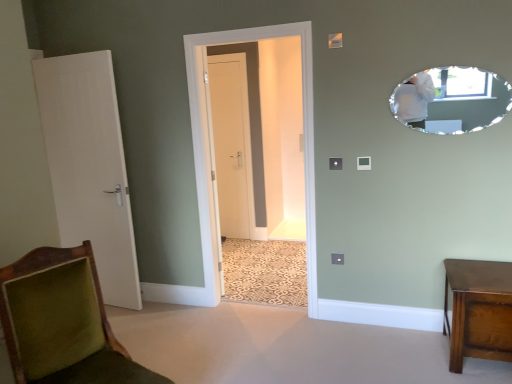
In order to face white matte door at center, the first door when ordered from back to front, should I rotate leftwards or rightwards?

You should look left and rotate roughly 3.662 degrees.

What is the approximate width of white wood door at left, the 2th door in the back-to-front sequence?

The width of white wood door at left, the 2th door in the back-to-front sequence, is 6.55 inches.

Describe the element at coordinates (89, 166) in the screenshot. I see `white wood door at left, which is the first door in front-to-back order` at that location.

You are a GUI agent. You are given a task and a screenshot of the screen. Output one action in this format:
    pyautogui.click(x=<x>, y=<y>)
    Task: Click on the shiny brown wooden side table at lower right
    The height and width of the screenshot is (384, 512).
    Given the screenshot: What is the action you would take?
    pyautogui.click(x=479, y=310)

What do you see at coordinates (62, 322) in the screenshot? I see `velvet green chair at lower left` at bounding box center [62, 322].

Where is `clear glass door at center`? Image resolution: width=512 pixels, height=384 pixels. clear glass door at center is located at coordinates (303, 130).

Locate an element on the screen. oval-shaped mirror at upper right is located at coordinates (452, 100).

Locate an element on the screen. glass door above the velvet green chair at lower left (from the image's perspective) is located at coordinates (303, 130).

Is clear glass door at center placed right next to velvet green chair at lower left?

clear glass door at center and velvet green chair at lower left are not in contact.

From a real-world perspective, which object stands above the other?

clear glass door at center, from a real-world perspective.

In the scene shown: Is velvet green chair at lower left located within clear glass door at center?

No, velvet green chair at lower left is not inside clear glass door at center.

Identify the location of the 2nd door counting from the left of the oval-shaped mirror at upper right. (89, 166).

Is point (414, 89) in front of point (51, 66)?

Yes, point (414, 89) is closer to viewer.

Which of these two, oval-shaped mirror at upper right or white wood door at left, which appears as the first door when viewed from the left, is bigger?

white wood door at left, which appears as the first door when viewed from the left.

Considering the relative positions of oval-shaped mirror at upper right and white wood door at left, which appears as the first door when viewed from the left, in the image provided, is oval-shaped mirror at upper right behind white wood door at left, which appears as the first door when viewed from the left,?

No, oval-shaped mirror at upper right is closer to the viewer.

Is shiny brown wooden side table at lower right in front of or behind white matte door at center, placed as the second door when sorted from left to right, in the image?

Visually, shiny brown wooden side table at lower right is located in front of white matte door at center, placed as the second door when sorted from left to right.

Where is `furniture in front of the white matte door at center, the first door when ordered from back to front`? This screenshot has width=512, height=384. furniture in front of the white matte door at center, the first door when ordered from back to front is located at coordinates (479, 310).

From a real-world perspective, is shiny brown wooden side table at lower right under white matte door at center, the 1th door when ordered from right to left?

Correct, in the physical world, shiny brown wooden side table at lower right is lower than white matte door at center, the 1th door when ordered from right to left.

In the scene shown: Is white matte door at center, the first door when ordered from back to front, at the right side of clear glass door at center?

Incorrect, white matte door at center, the first door when ordered from back to front, is not on the right side of clear glass door at center.

Is point (234, 145) more distant than point (306, 35)?

Yes.

Considering the sizes of white matte door at center, the first door when ordered from back to front, and clear glass door at center in the image, is white matte door at center, the first door when ordered from back to front, bigger or smaller than clear glass door at center?

Clearly, white matte door at center, the first door when ordered from back to front, is smaller in size than clear glass door at center.

Is white matte door at center, placed as the second door when sorted from left to right, oriented towards clear glass door at center?

No, white matte door at center, placed as the second door when sorted from left to right, is not turned towards clear glass door at center.

Based on the photo, do you think shiny brown wooden side table at lower right is within clear glass door at center, or outside of it?

shiny brown wooden side table at lower right is outside clear glass door at center.

From a real-world perspective, who is located lower, shiny brown wooden side table at lower right or clear glass door at center?

In real-world perspective, shiny brown wooden side table at lower right is lower.

Can you confirm if shiny brown wooden side table at lower right is wider than clear glass door at center?

Yes, shiny brown wooden side table at lower right is wider than clear glass door at center.

Is shiny brown wooden side table at lower right further to the viewer compared to clear glass door at center?

That is False.

How much distance is there between oval-shaped mirror at upper right and clear glass door at center?

oval-shaped mirror at upper right is 35.79 inches from clear glass door at center.

Is oval-shaped mirror at upper right bigger or smaller than clear glass door at center?

In the image, oval-shaped mirror at upper right appears to be smaller than clear glass door at center.

Based on the photo, which object is closer to the camera, oval-shaped mirror at upper right or clear glass door at center?

Positioned in front is oval-shaped mirror at upper right.

Can you see oval-shaped mirror at upper right touching clear glass door at center?

No, oval-shaped mirror at upper right is not beside clear glass door at center.

From a real-world perspective, between white wood door at left, the 2th door in the back-to-front sequence, and velvet green chair at lower left, who is vertically lower?

velvet green chair at lower left is physically lower.

From the image's perspective, between white wood door at left, acting as the second door starting from the right, and velvet green chair at lower left, which one is located above?

white wood door at left, acting as the second door starting from the right, appears higher in the image.

Is white wood door at left, which appears as the first door when viewed from the left, outside of velvet green chair at lower left?

white wood door at left, which appears as the first door when viewed from the left, lies outside velvet green chair at lower left's area.

Locate an element on the screen. This screenshot has width=512, height=384. chair in front of the clear glass door at center is located at coordinates (62, 322).

From the oval-shaped mirror at upper right, count the 2nd door to the left and point to it. Please provide its 2D coordinates.

[(89, 166)]

When comparing their distances from shiny brown wooden side table at lower right, does velvet green chair at lower left or white wood door at left, the 2th door in the back-to-front sequence, seem closer?

velvet green chair at lower left is positioned closer to the anchor shiny brown wooden side table at lower right.

Based on their spatial positions, is shiny brown wooden side table at lower right or oval-shaped mirror at upper right further from white wood door at left, which is the first door in front-to-back order?

Among the two, shiny brown wooden side table at lower right is located further to white wood door at left, which is the first door in front-to-back order.

Looking at the image, which one is located closer to oval-shaped mirror at upper right, clear glass door at center or white matte door at center, placed as the second door when sorted from left to right?

clear glass door at center is closer to oval-shaped mirror at upper right.

Looking at the image, which one is located further to velvet green chair at lower left, white wood door at left, acting as the second door starting from the right, or white matte door at center, the 1th door when ordered from right to left?

Among the two, white matte door at center, the 1th door when ordered from right to left, is located further to velvet green chair at lower left.

Estimate the real-world distances between objects in this image. Which object is closer to clear glass door at center, white wood door at left, acting as the second door starting from the right, or white matte door at center, the first door when ordered from back to front?

white wood door at left, acting as the second door starting from the right, is positioned closer to the anchor clear glass door at center.

When comparing their distances from velvet green chair at lower left, does white matte door at center, placed as the second door when sorted from left to right, or shiny brown wooden side table at lower right seem further?

white matte door at center, placed as the second door when sorted from left to right, lies further to velvet green chair at lower left than the other object.

Considering their positions, is shiny brown wooden side table at lower right positioned further to oval-shaped mirror at upper right than velvet green chair at lower left?

velvet green chair at lower left is positioned further to the anchor oval-shaped mirror at upper right.

In the scene shown: Estimate the real-world distances between objects in this image. Which object is closer to white matte door at center, the first door when ordered from back to front, velvet green chair at lower left or clear glass door at center?

clear glass door at center lies closer to white matte door at center, the first door when ordered from back to front, than the other object.

Where is `glass door positioned between shiny brown wooden side table at lower right and white matte door at center, placed as the second door when sorted from left to right, from near to far`? This screenshot has width=512, height=384. glass door positioned between shiny brown wooden side table at lower right and white matte door at center, placed as the second door when sorted from left to right, from near to far is located at coordinates (303, 130).

What are the coordinates of `mirror positioned between shiny brown wooden side table at lower right and white matte door at center, the 2th door in the front-to-back sequence, from near to far` in the screenshot? It's located at (452, 100).

Identify the location of chair located between white wood door at left, acting as the second door starting from the right, and shiny brown wooden side table at lower right in the left-right direction. The image size is (512, 384). (62, 322).

Locate an element on the screen. This screenshot has height=384, width=512. glass door between velvet green chair at lower left and white matte door at center, placed as the second door when sorted from left to right, along the z-axis is located at coordinates pos(303,130).